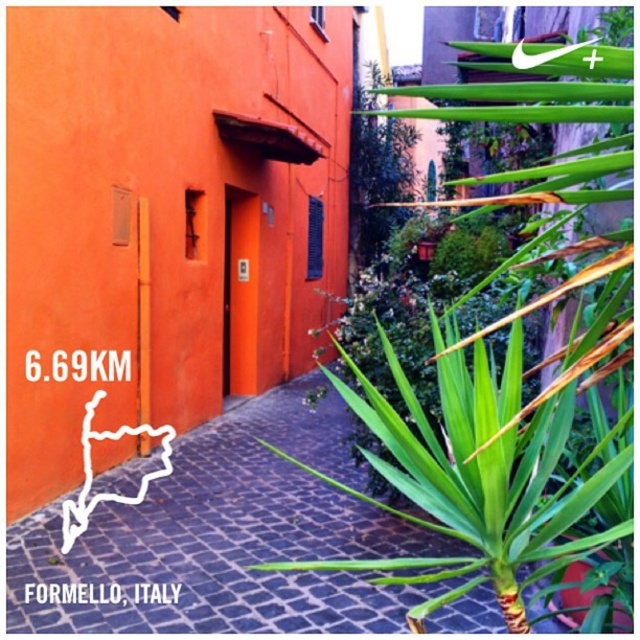
Question: Does green leafy plant at center right lie behind green leafy plant at lower right?

Choices:
 (A) no
 (B) yes

Answer: (A)

Question: Is green leafy plant at center right positioned behind green leafy plant at lower right?

Choices:
 (A) yes
 (B) no

Answer: (B)

Question: Which object appears closest to the camera in this image?

Choices:
 (A) green leafy plant at center right
 (B) green leafy plant at lower right

Answer: (A)

Question: Among these points, which one is farthest from the camera?

Choices:
 (A) (236, 416)
 (B) (528, 314)

Answer: (A)

Question: Does green leafy plant at center right have a larger size compared to green leafy plant at lower right?

Choices:
 (A) yes
 (B) no

Answer: (A)